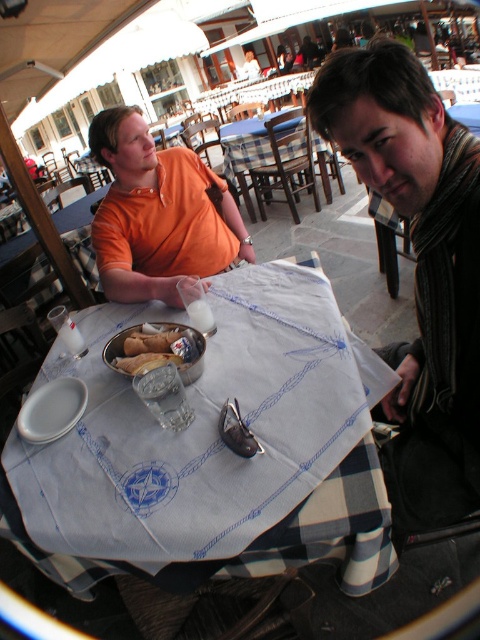
Question: Among these objects, which one is nearest to the camera?

Choices:
 (A) orange cotton shirt at upper left
 (B) striped scarf at right
 (C) bread soft at center
 (D) white cloth at center

Answer: (B)

Question: Considering the real-world distances, which object is closest to the orange cotton shirt at upper left?

Choices:
 (A) bread soft at center
 (B) white cloth at center
 (C) striped scarf at right

Answer: (A)

Question: Among these points, which one is farthest from the camera?

Choices:
 (A) (439, 202)
 (B) (158, 177)
 (C) (168, 358)
 (D) (196, 536)

Answer: (B)

Question: Is striped scarf at right to the right of orange cotton shirt at upper left from the viewer's perspective?

Choices:
 (A) no
 (B) yes

Answer: (B)

Question: Is the position of striped scarf at right more distant than that of orange cotton shirt at upper left?

Choices:
 (A) yes
 (B) no

Answer: (B)

Question: Where is striped scarf at right located in relation to orange cotton shirt at upper left in the image?

Choices:
 (A) right
 (B) left

Answer: (A)